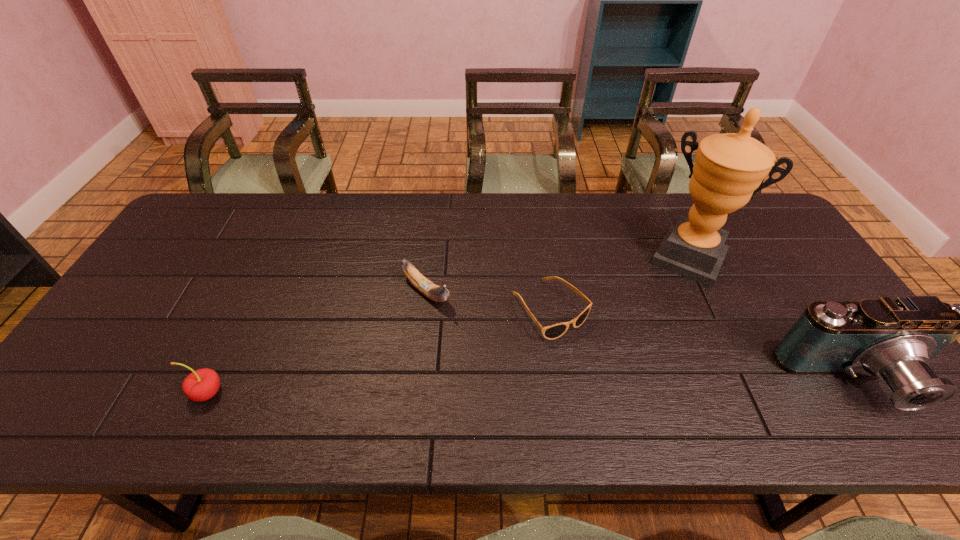
Find the location of a particular element. This screenshot has width=960, height=540. vacant area at the left edge of the desktop is located at coordinates (180, 298).

In the image, there is a desktop. Where is `free space at the right edge`? free space at the right edge is located at coordinates (810, 285).

The image size is (960, 540). What are the coordinates of `empty space that is in between the sunglasses and the third shortest object` in the screenshot? It's located at (379, 351).

This screenshot has height=540, width=960. In order to click on vacant area that lies between the leftmost object and the sunglasses in this screenshot , I will do pos(379,351).

Identify the location of vacant area that lies between the leftmost object and the shortest object. This screenshot has width=960, height=540. (379, 351).

Find the location of a particular element. blank region between the third object from left to right and the cherry is located at coordinates click(379, 351).

Where is `vacant space that is in between the banana and the sunglasses`? The height and width of the screenshot is (540, 960). vacant space that is in between the banana and the sunglasses is located at coordinates (489, 301).

The image size is (960, 540). In order to click on free area in between the tallest object and the third object from right to left in this screenshot , I will do pos(619,284).

Identify which object is the fourth nearest to the award. Please provide its 2D coordinates. Your answer should be formatted as a tuple, i.e. [(x, y)], where the tuple contains the x and y coordinates of a point satisfying the conditions above.

[(200, 385)]

The height and width of the screenshot is (540, 960). What are the coordinates of `the closest object to the second object from left to right` in the screenshot? It's located at (551, 332).